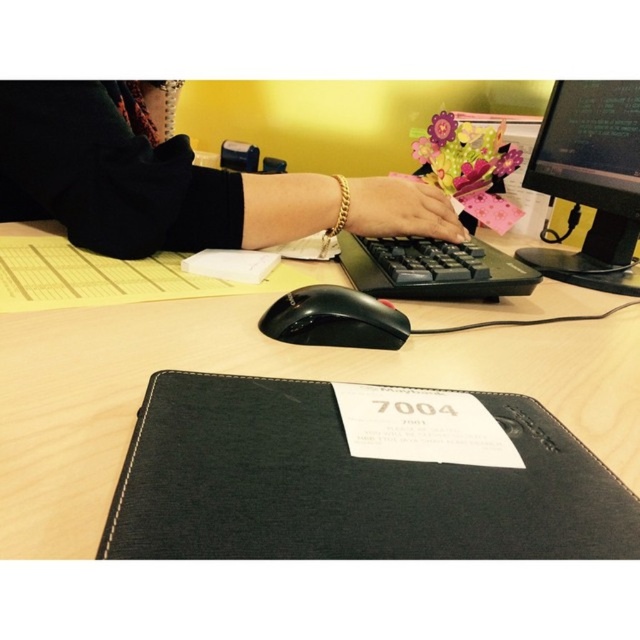
You are standing in an office and see the black leather jacket at center. If you want to reach it without moving your feet, can you do it?

The black leather jacket at center is 20.92 inches from viewer, so yes, you can reach it without moving your feet since it is within arm reach.